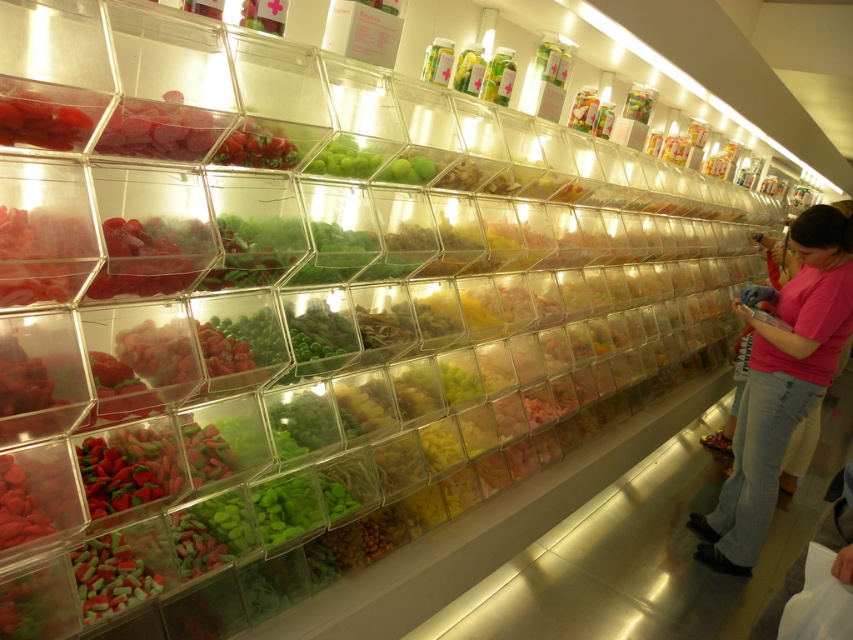
Question: Which object appears closest to the camera in this image?

Choices:
 (A) matte red candy at upper left
 (B) pink fabric shirt at right

Answer: (A)

Question: Which object is farther from the camera taking this photo?

Choices:
 (A) matte red candy at upper left
 (B) matte red candy at left

Answer: (A)

Question: Can you confirm if pink fabric shirt at right is positioned below matte red candy at left?

Choices:
 (A) no
 (B) yes

Answer: (B)

Question: Considering the relative positions of pink fabric shirt at right and matte red candy at left in the image provided, where is pink fabric shirt at right located with respect to matte red candy at left?

Choices:
 (A) left
 (B) right

Answer: (B)

Question: Can you confirm if pink fabric shirt at right is positioned above matte red candy at upper left?

Choices:
 (A) no
 (B) yes

Answer: (A)

Question: Which point is farther to the camera?

Choices:
 (A) matte red candy at left
 (B) matte red candy at upper left
 (C) pink fabric shirt at right

Answer: (C)